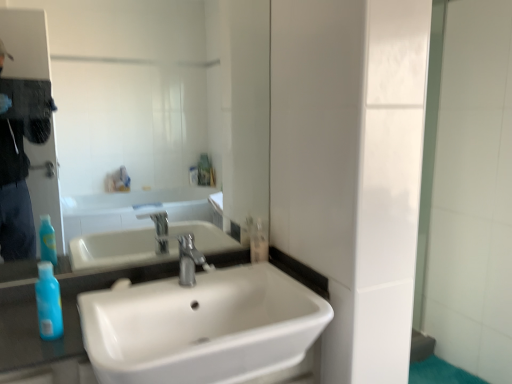
This screenshot has height=384, width=512. I want to click on empty space that is in between clear plastic bottle at center, placed as the first mouthwash when sorted from right to left, and silver metallic faucet at center, so click(228, 270).